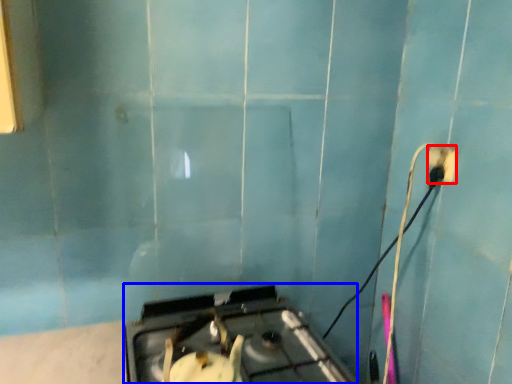
Question: Which object appears closest to the camera in this image, power plugs and sockets (highlighted by a red box) or gas stove (highlighted by a blue box)?

Choices:
 (A) power plugs and sockets
 (B) gas stove

Answer: (B)